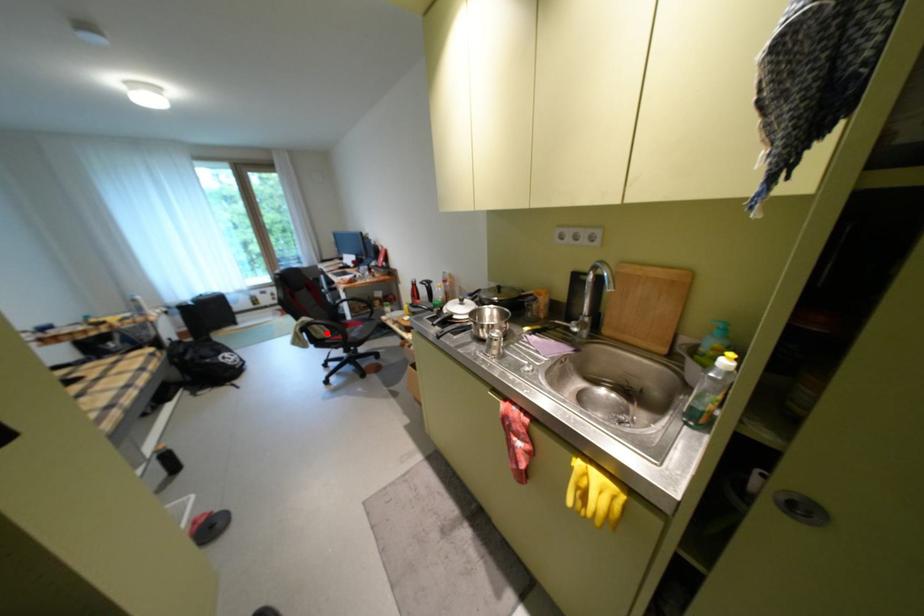
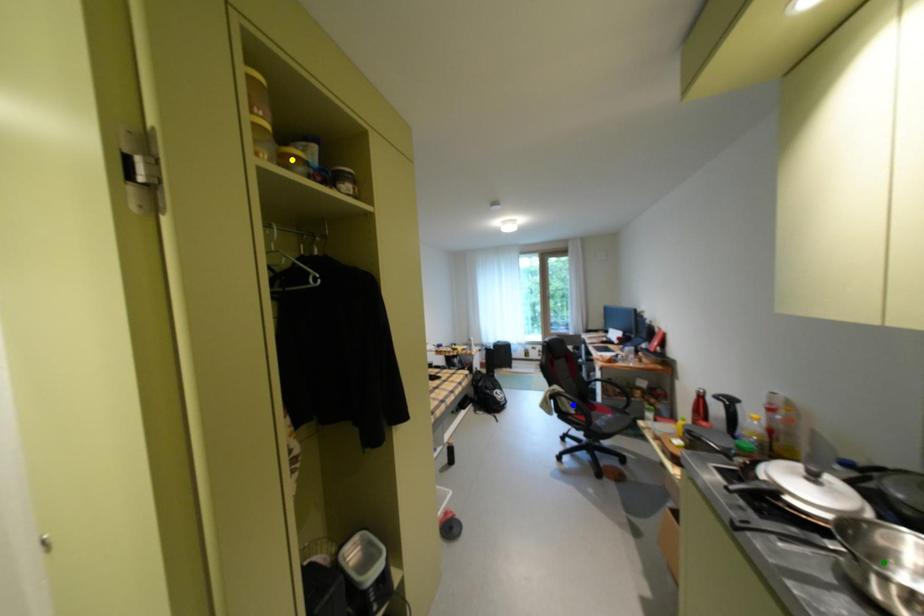
Question: I am providing you with two images of the same scene from different viewpoints. A red point is marked on the first image. You are given multiple points on the second image. Which mark in image 2 goes with the point in image 1?

Choices:
 (A) blue point
 (B) yellow point
 (C) green point

Answer: (A)